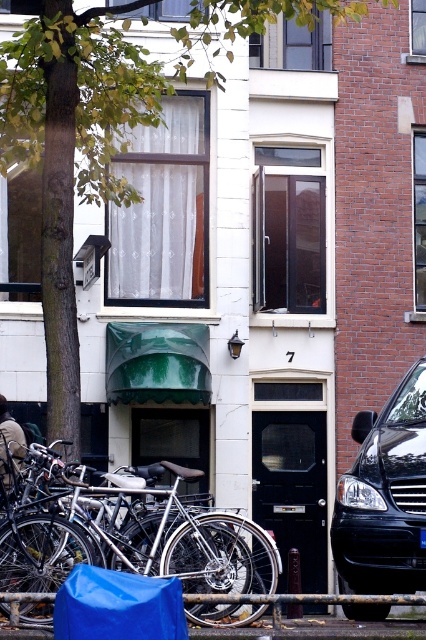
Question: Which object appears closest to the camera in this image?

Choices:
 (A) blue tarp at lower left
 (B) silver metallic bicycle at center

Answer: (A)

Question: Among these objects, which one is farthest from the camera?

Choices:
 (A) blue tarp at lower left
 (B) silver metallic bicycle at center

Answer: (B)

Question: Can you confirm if silver metallic bicycle at center is positioned to the left of blue tarp at lower left?

Choices:
 (A) yes
 (B) no

Answer: (A)

Question: Is silver metallic bicycle at center smaller than black glossy van at lower right?

Choices:
 (A) yes
 (B) no

Answer: (B)

Question: Can you confirm if silver metallic bicycle at center is wider than black glossy van at lower right?

Choices:
 (A) no
 (B) yes

Answer: (B)

Question: Among these objects, which one is nearest to the camera?

Choices:
 (A) silver metallic bicycle at center
 (B) black glossy van at lower right
 (C) blue tarp at lower left

Answer: (C)